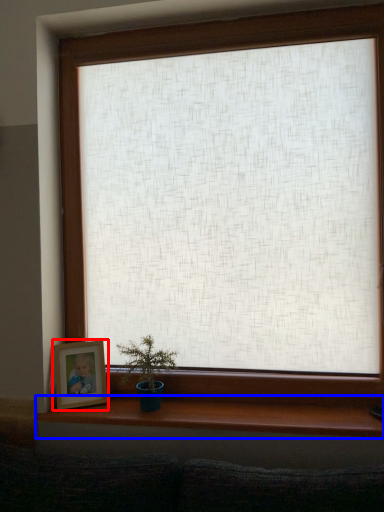
Question: Among these objects, which one is farthest to the camera, picture frame (highlighted by a red box) or window sill (highlighted by a blue box)?

Choices:
 (A) picture frame
 (B) window sill

Answer: (A)